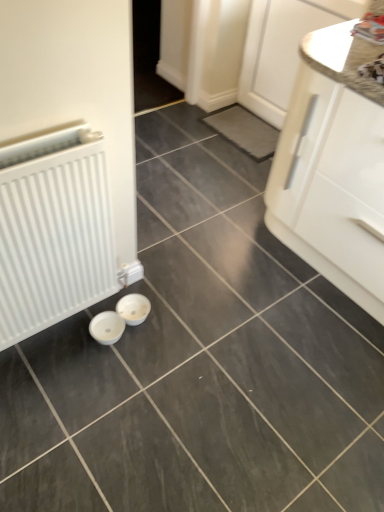
The width and height of the screenshot is (384, 512). Identify the location of vacant area located to the right-hand side of white matte radiator at left. (165, 341).